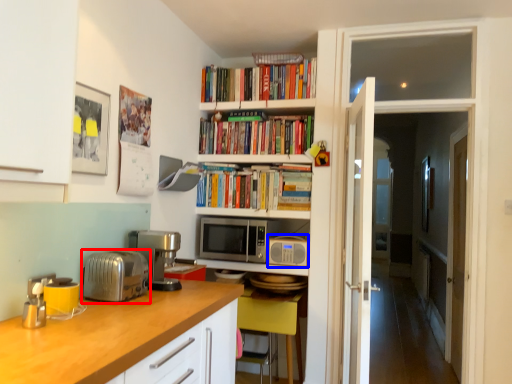
Question: Among these objects, which one is farthest to the camera, toaster (highlighted by a red box) or appliance (highlighted by a blue box)?

Choices:
 (A) toaster
 (B) appliance

Answer: (B)